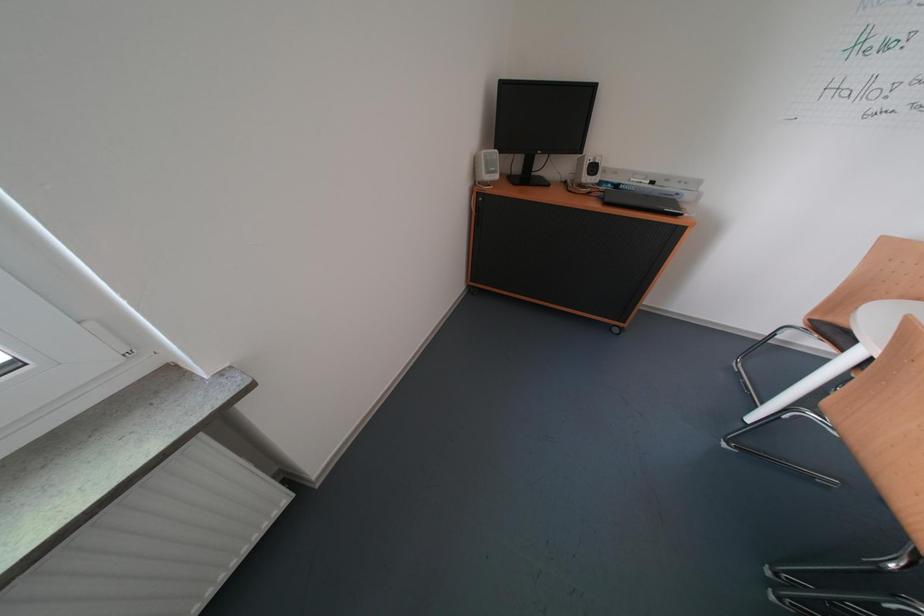
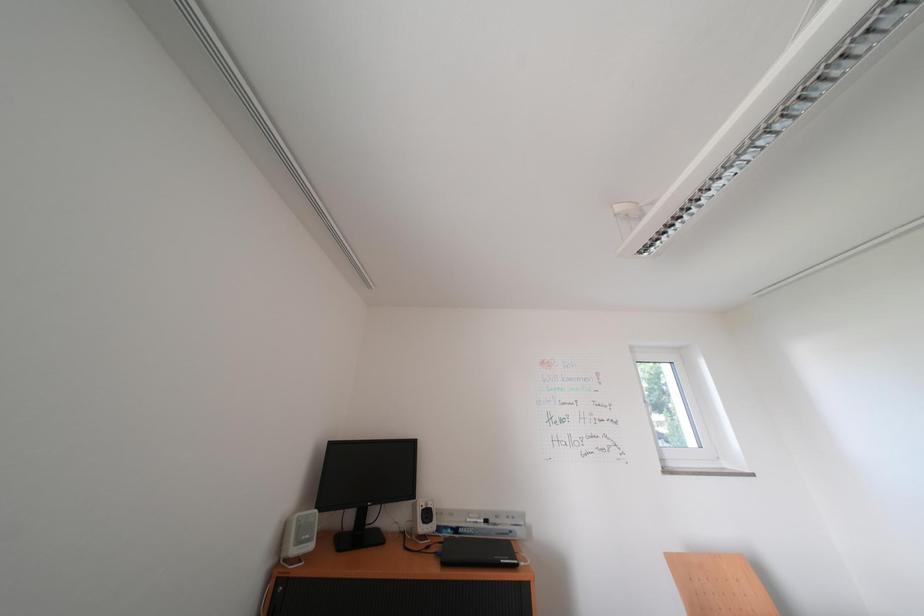
The first image is from the beginning of the video and the second image is from the end. How did the camera likely rotate when shooting the video?

The camera rotated toward right-up.